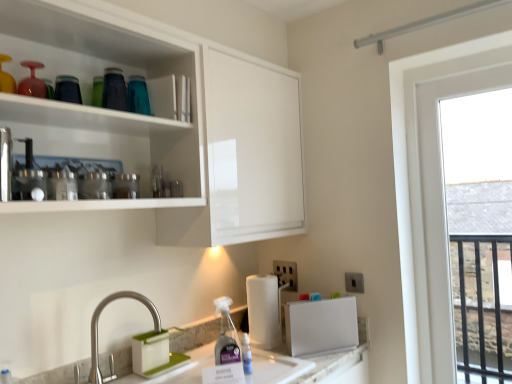
Question: Is metallic silver blender at upper left, which ranks as the first appliance in top-to-bottom order, looking in the opposite direction of white plastic electric outlet at lower center, placed as the second electric outlet when sorted from front to back?

Choices:
 (A) yes
 (B) no

Answer: (B)

Question: Is metallic silver blender at upper left, which is counted as the second appliance, starting from the back, wider than white plastic electric outlet at lower center, which is the second electric outlet in right-to-left order?

Choices:
 (A) yes
 (B) no

Answer: (A)

Question: From the image's perspective, is metallic silver blender at upper left, which is counted as the second appliance, starting from the back, beneath white plastic electric outlet at lower center, placed as the second electric outlet when sorted from front to back?

Choices:
 (A) no
 (B) yes

Answer: (A)

Question: Considering the relative sizes of metallic silver blender at upper left, which is counted as the second appliance, starting from the back, and white plastic electric outlet at lower center, which ranks as the 1th electric outlet in back-to-front order, in the image provided, is metallic silver blender at upper left, which is counted as the second appliance, starting from the back, taller than white plastic electric outlet at lower center, which ranks as the 1th electric outlet in back-to-front order,?

Choices:
 (A) no
 (B) yes

Answer: (A)

Question: Would you say metallic silver blender at upper left, which is counted as the second appliance, starting from the bottom, contains white plastic electric outlet at lower center, which ranks as the 1th electric outlet in back-to-front order?

Choices:
 (A) yes
 (B) no

Answer: (B)

Question: Is white plastic electric outlet at lower center, which is the second electric outlet in right-to-left order, bigger or smaller than white plastic electric outlet at lower right, the first electric outlet viewed from the front?

Choices:
 (A) small
 (B) big

Answer: (B)

Question: Is white plastic electric outlet at lower center, marked as the first electric outlet in a left-to-right arrangement, spatially inside white plastic electric outlet at lower right, which ranks as the 2th electric outlet in left-to-right order, or outside of it?

Choices:
 (A) outside
 (B) inside

Answer: (A)

Question: Considering the positions of white plastic electric outlet at lower center, marked as the first electric outlet in a left-to-right arrangement, and white plastic electric outlet at lower right, the first electric outlet viewed from the front, in the image, is white plastic electric outlet at lower center, marked as the first electric outlet in a left-to-right arrangement, taller or shorter than white plastic electric outlet at lower right, the first electric outlet viewed from the front,?

Choices:
 (A) tall
 (B) short

Answer: (A)

Question: From the image's perspective, is white plastic electric outlet at lower center, which ranks as the 1th electric outlet in back-to-front order, positioned above or below white plastic electric outlet at lower right, which is counted as the second electric outlet, starting from the back?

Choices:
 (A) below
 (B) above

Answer: (A)

Question: Is white plastic electric outlet at lower right, placed as the first electric outlet when sorted from right to left, to the left or to the right of transparent glass window at right in the image?

Choices:
 (A) left
 (B) right

Answer: (A)

Question: Considering the positions of point (354, 286) and point (476, 144), is point (354, 286) closer or farther from the camera than point (476, 144)?

Choices:
 (A) farther
 (B) closer

Answer: (A)

Question: From a real-world perspective, relative to transparent glass window at right, is white plastic electric outlet at lower right, which ranks as the 2th electric outlet in left-to-right order, vertically above or below?

Choices:
 (A) above
 (B) below

Answer: (B)

Question: Is white plastic electric outlet at lower right, which is counted as the second electric outlet, starting from the back, situated inside transparent glass window at right or outside?

Choices:
 (A) inside
 (B) outside

Answer: (B)

Question: Considering their positions, is white plastic magnetic board at lower center, the second appliance from the left, located in front of or behind white matte paper towel at lower center?

Choices:
 (A) behind
 (B) front

Answer: (B)

Question: From a real-world perspective, is white plastic magnetic board at lower center, which is counted as the 2th appliance, starting from the top, physically located above or below white matte paper towel at lower center?

Choices:
 (A) above
 (B) below

Answer: (B)